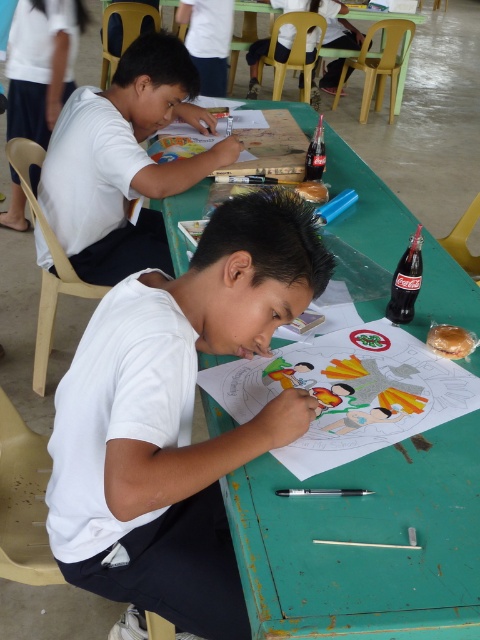
Question: Which object appears farthest from the camera in this image?

Choices:
 (A) white paper at center
 (B) white matte shirt at upper left

Answer: (B)

Question: Does white paper at center appear under white matte shirt at upper left?

Choices:
 (A) no
 (B) yes

Answer: (B)

Question: Is white paper at center in front of white matte shirt at upper left?

Choices:
 (A) no
 (B) yes

Answer: (B)

Question: Estimate the real-world distances between objects in this image. Which object is closer to the white paper at center?

Choices:
 (A) white matte shirt at upper left
 (B) green painted wood table at center

Answer: (B)

Question: Estimate the real-world distances between objects in this image. Which object is closer to the white matte shirt at upper left?

Choices:
 (A) white paper at center
 (B) green painted wood table at center

Answer: (B)

Question: Where is green painted wood table at center located in relation to white matte shirt at upper left in the image?

Choices:
 (A) right
 (B) left

Answer: (A)